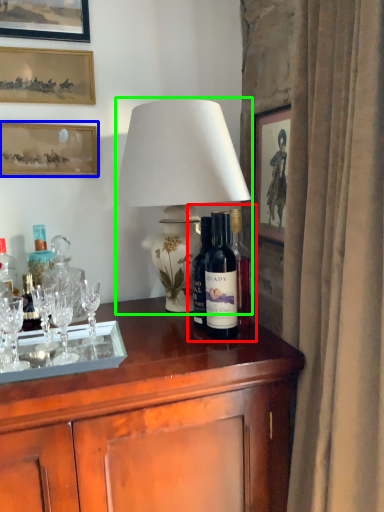
Question: Which is farther away from wine tasting (highlighted by a red box)? picture frame (highlighted by a blue box) or lamp (highlighted by a green box)?

Choices:
 (A) picture frame
 (B) lamp

Answer: (A)